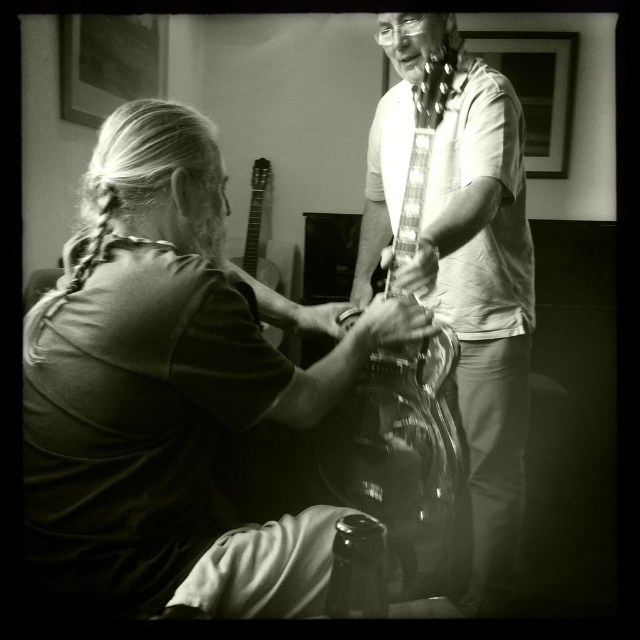
What is located at the coordinates point (356, 570)?

A translucent glass bottle at lower center is located at point (356, 570).

You are a photographer adjusting your camera settings to capture the scene. You notice the glossy wood guitar at center and the translucent glass bottle at lower center. Which object should you focus on first if you want to ensure both are in sharp focus?

The glossy wood guitar at center is further to the viewer than the translucent glass bottle at lower center, so you should focus on the glossy wood guitar at center first to ensure both are in sharp focus.

Based on the scene description, where is the smooth leather guitar at center located in terms of coordinates?

The smooth leather guitar at center is located at coordinates point (170,392).